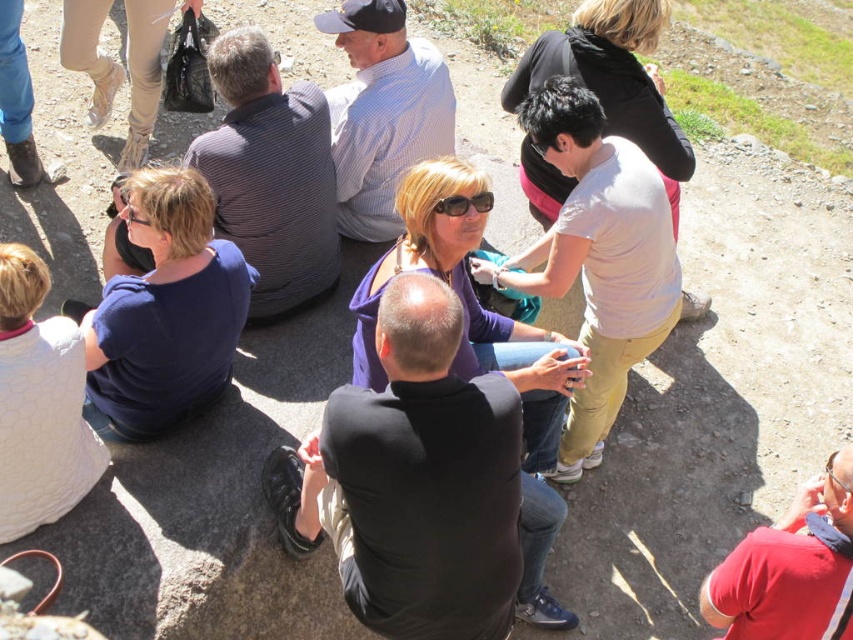
Question: Is red cotton shirt at lower right below black plastic sunglasses at center?

Choices:
 (A) yes
 (B) no

Answer: (A)

Question: Does red cotton shirt at lower right have a larger size compared to black plastic sunglasses at center?

Choices:
 (A) no
 (B) yes

Answer: (B)

Question: Which object is closer to the camera taking this photo?

Choices:
 (A) red cotton shirt at lower right
 (B) black plastic sunglasses at center

Answer: (A)

Question: Is red cotton shirt at lower right bigger than black plastic sunglasses at center?

Choices:
 (A) no
 (B) yes

Answer: (B)

Question: Which of the following is the closest to the observer?

Choices:
 (A) red cotton shirt at lower right
 (B) black plastic sunglasses at center

Answer: (A)